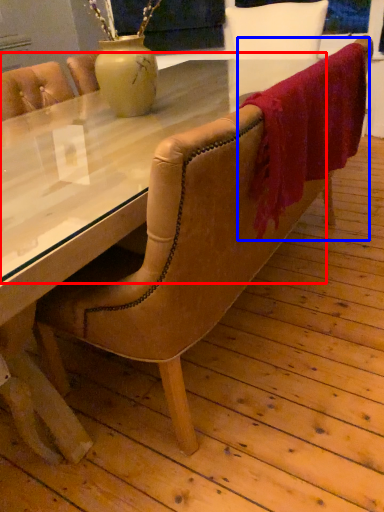
Question: Among these objects, which one is nearest to the camera, glass table (highlighted by a red box) or blanket (highlighted by a blue box)?

Choices:
 (A) glass table
 (B) blanket

Answer: (A)